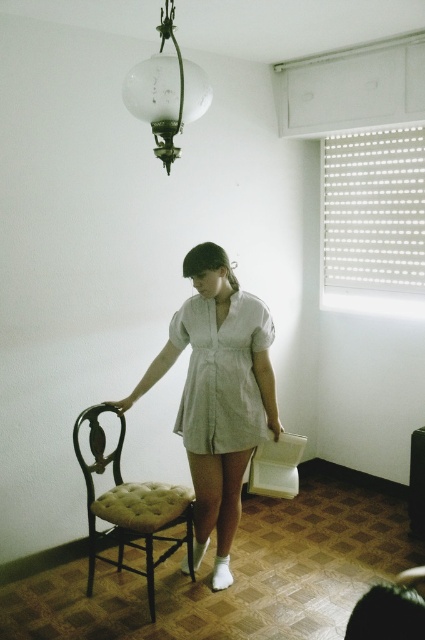
Question: Which point is closer to the camera taking this photo?

Choices:
 (A) (223, 323)
 (B) (155, 525)
 (C) (144, 72)
 (D) (204, 332)

Answer: (C)

Question: Is tufted fabric armchair at center behind translucent glass globe at upper center?

Choices:
 (A) no
 (B) yes

Answer: (B)

Question: Which point is closer to the camera taking this photo?

Choices:
 (A) (175, 84)
 (B) (172, 326)
 (C) (141, 497)

Answer: (A)

Question: Which point appears farthest from the camera in this image?

Choices:
 (A) (254, 442)
 (B) (170, 22)
 (C) (84, 417)

Answer: (C)

Question: Can you confirm if white cotton dress at center is wider than translucent glass globe at upper center?

Choices:
 (A) no
 (B) yes

Answer: (B)

Question: Can you confirm if light green linen dress at center is wider than translucent glass globe at upper center?

Choices:
 (A) yes
 (B) no

Answer: (A)